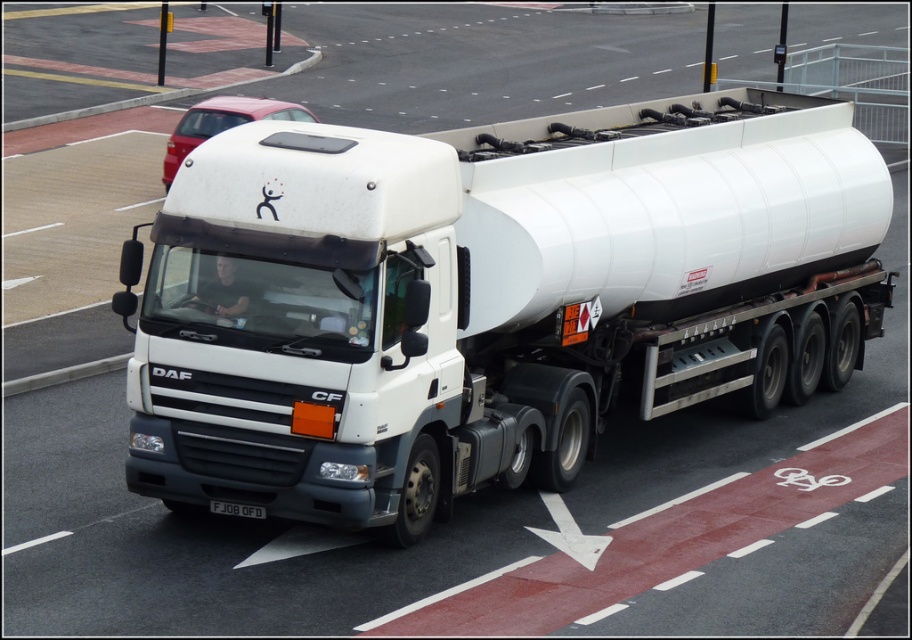
Question: Which point is farther from the camera taking this photo?

Choices:
 (A) (244, 508)
 (B) (881, 209)
 (C) (172, 140)

Answer: (C)

Question: Does metallic red car at upper center have a greater width compared to white plastic license plate at center?

Choices:
 (A) yes
 (B) no

Answer: (A)

Question: Where is white matte tanker at center located in relation to metallic red car at upper center in the image?

Choices:
 (A) right
 (B) left

Answer: (A)

Question: Which of the following is the closest to the observer?

Choices:
 (A) 303,499
 (B) 229,116

Answer: (A)

Question: Can you confirm if metallic red car at upper center is wider than white plastic license plate at center?

Choices:
 (A) no
 (B) yes

Answer: (B)

Question: Which object is closer to the camera taking this photo?

Choices:
 (A) white matte tanker at center
 (B) white plastic license plate at center
 (C) metallic red car at upper center

Answer: (A)